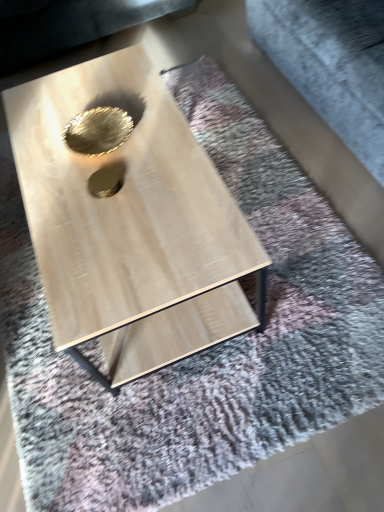
Locate an element on the screen. vacant space to the right of gold metallic hole at center, the first hole positioned from the front is located at coordinates (163, 170).